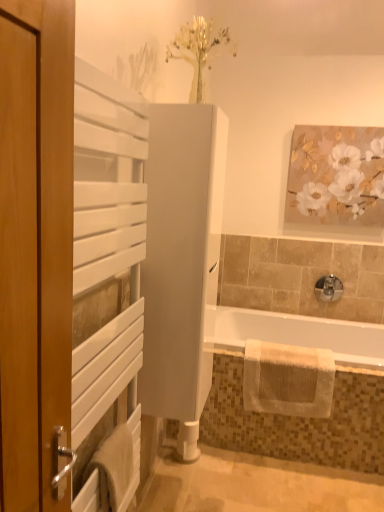
I want to click on white textured towel at lower right, which appears as the 2th bath towel when viewed from the left, so click(x=288, y=379).

The height and width of the screenshot is (512, 384). What do you see at coordinates (336, 176) in the screenshot? I see `gold textured canvas at upper right` at bounding box center [336, 176].

At what (x,y) coordinates should I click in order to perform the action: click on satin nickel faucet at lower right. Please return your answer as a coordinate pair (x, y). Looking at the image, I should click on point(328,288).

Are white textured towel at lower right, placed as the 1th bath towel when sorted from back to front, and satin nickel faucet at lower right beside each other?

white textured towel at lower right, placed as the 1th bath towel when sorted from back to front, and satin nickel faucet at lower right are clearly separated.

From the image's perspective, between white textured towel at lower right, placed as the 2th bath towel when sorted from front to back, and satin nickel faucet at lower right, who is located below?

white textured towel at lower right, placed as the 2th bath towel when sorted from front to back, appears lower in the image.

Which is in front, white textured towel at lower right, placed as the 1th bath towel when sorted from right to left, or satin nickel faucet at lower right?

white textured towel at lower right, placed as the 1th bath towel when sorted from right to left.

Are white textured towel at lower left, the 2th bath towel in the right-to-left sequence, and satin nickel faucet at lower right located far from each other?

Yes.

Is white textured towel at lower left, which ranks as the 1th bath towel in front-to-back order, to the left of satin nickel faucet at lower right from the viewer's perspective?

Yes, white textured towel at lower left, which ranks as the 1th bath towel in front-to-back order, is to the left of satin nickel faucet at lower right.

Is white textured towel at lower left, which ranks as the 1th bath towel in front-to-back order, spatially inside satin nickel faucet at lower right, or outside of it?

white textured towel at lower left, which ranks as the 1th bath towel in front-to-back order, is not enclosed by satin nickel faucet at lower right.

Is white textured towel at lower left, the 2th bath towel when ordered from back to front, turned away from satin nickel faucet at lower right?

No, satin nickel faucet at lower right is not at the back of white textured towel at lower left, the 2th bath towel when ordered from back to front.

From the image's perspective, is white glossy tub at lower right under white matte cabinet at center, acting as the 1th screen door starting from the back?

Yes, from the image's perspective, white glossy tub at lower right is beneath white matte cabinet at center, acting as the 1th screen door starting from the back.

Does white glossy tub at lower right come behind white matte cabinet at center, acting as the 1th screen door starting from the back?

That is True.

Is white glossy tub at lower right located outside white matte cabinet at center, which is the second screen door in front-to-back order?

That's correct, white glossy tub at lower right is outside of white matte cabinet at center, which is the second screen door in front-to-back order.

How different are the orientations of white glossy tub at lower right and white matte cabinet at center, acting as the 1th screen door starting from the back, in degrees?

The facing directions of white glossy tub at lower right and white matte cabinet at center, acting as the 1th screen door starting from the back, are 90 degrees apart.

Considering the sizes of white glossy bathtub at lower center and white glossy tub at lower right in the image, is white glossy bathtub at lower center wider or thinner than white glossy tub at lower right?

white glossy bathtub at lower center is wider than white glossy tub at lower right.

From the image's perspective, between white glossy bathtub at lower center and white glossy tub at lower right, who is located below?

From the image's view, white glossy tub at lower right is below.

Considering their positions, is white glossy bathtub at lower center located in front of or behind white glossy tub at lower right?

Visually, white glossy bathtub at lower center is located in front of white glossy tub at lower right.

Which object is closer to the camera taking this photo, white textured towel at lower right, which appears as the 2th bath towel when viewed from the left, or white textured towel at lower left, which ranks as the 1th bath towel in front-to-back order?

white textured towel at lower left, which ranks as the 1th bath towel in front-to-back order, is in front.

Where is `bath towel that is behind the white textured towel at lower left, the 2th bath towel in the right-to-left sequence`? bath towel that is behind the white textured towel at lower left, the 2th bath towel in the right-to-left sequence is located at coordinates (288, 379).

Who is taller, white textured towel at lower right, placed as the 2th bath towel when sorted from front to back, or white textured towel at lower left, which ranks as the 1th bath towel in left-to-right order?

white textured towel at lower right, placed as the 2th bath towel when sorted from front to back.

Based on the photo, from a real-world perspective, is white textured towel at lower right, placed as the 2th bath towel when sorted from front to back, beneath white textured towel at lower left, the 2th bath towel when ordered from back to front?

Yes, from a real-world perspective, white textured towel at lower right, placed as the 2th bath towel when sorted from front to back, is under white textured towel at lower left, the 2th bath towel when ordered from back to front.

From a real-world perspective, is white glossy tub at lower right on top of satin nickel faucet at lower right?

No, from a real-world perspective, white glossy tub at lower right is not on top of satin nickel faucet at lower right.

Based on the photo, which is more to the left, white glossy tub at lower right or satin nickel faucet at lower right?

white glossy tub at lower right is more to the left.

Considering the sizes of white glossy tub at lower right and satin nickel faucet at lower right in the image, is white glossy tub at lower right taller or shorter than satin nickel faucet at lower right?

white glossy tub at lower right is taller than satin nickel faucet at lower right.

You are a GUI agent. You are given a task and a screenshot of the screen. Output one action in this format:
    pyautogui.click(x=<x>, y=<y>)
    Task: Click on the tap that is on the right side of white glossy tub at lower right
    The height and width of the screenshot is (512, 384).
    Given the screenshot: What is the action you would take?
    pyautogui.click(x=328, y=288)

In the image, is satin nickel faucet at lower right positioned in front of or behind white textured towel at lower left, the 2th bath towel in the right-to-left sequence?

satin nickel faucet at lower right is behind white textured towel at lower left, the 2th bath towel in the right-to-left sequence.

Between satin nickel faucet at lower right and white textured towel at lower left, the 2th bath towel in the right-to-left sequence, which one has larger size?

white textured towel at lower left, the 2th bath towel in the right-to-left sequence.

Looking at this image, would you consider satin nickel faucet at lower right to be distant from white textured towel at lower left, which ranks as the 1th bath towel in front-to-back order?

Yes, satin nickel faucet at lower right and white textured towel at lower left, which ranks as the 1th bath towel in front-to-back order, are quite far apart.

Is point (336, 278) in front of point (110, 499)?

No, (336, 278) is behind (110, 499).

Where is `tap behind the white textured towel at lower right, placed as the 1th bath towel when sorted from right to left`? The width and height of the screenshot is (384, 512). tap behind the white textured towel at lower right, placed as the 1th bath towel when sorted from right to left is located at coordinates (328, 288).

This screenshot has height=512, width=384. What are the coordinates of `the 2nd bath towel in front of the satin nickel faucet at lower right, starting your count from the anchor` in the screenshot? It's located at (113, 466).

Estimate the real-world distances between objects in this image. Which object is further from gold textured canvas at upper right, satin nickel faucet at lower right or white textured towel at lower right, placed as the 1th bath towel when sorted from back to front?

white textured towel at lower right, placed as the 1th bath towel when sorted from back to front, is positioned further to the anchor gold textured canvas at upper right.

From the image, which object appears to be farther from satin nickel faucet at lower right, gold textured canvas at upper right or white textured towel at lower left, the 2th bath towel in the right-to-left sequence?

Among the two, white textured towel at lower left, the 2th bath towel in the right-to-left sequence, is located further to satin nickel faucet at lower right.

Considering their positions, is white textured towel at lower left, the 2th bath towel in the right-to-left sequence, positioned further to satin nickel faucet at lower right than white matte cabinet at center, which is the second screen door in front-to-back order?

Among the two, white textured towel at lower left, the 2th bath towel in the right-to-left sequence, is located further to satin nickel faucet at lower right.

Estimate the real-world distances between objects in this image. Which object is further from white matte radiator at left, the 2th screen door positioned from the back, white glossy bathtub at lower center or white glossy tub at lower right?

white glossy bathtub at lower center.

From the picture: When comparing their distances from satin nickel faucet at lower right, does white glossy tub at lower right or gold textured canvas at upper right seem further?

white glossy tub at lower right.

Based on their spatial positions, is white glossy bathtub at lower center or gold textured canvas at upper right closer to white textured towel at lower left, which ranks as the 1th bath towel in left-to-right order?

Based on the image, white glossy bathtub at lower center appears to be nearer to white textured towel at lower left, which ranks as the 1th bath towel in left-to-right order.

Which object lies further to the anchor point white glossy tub at lower right, gold textured canvas at upper right or white textured towel at lower right, placed as the 2th bath towel when sorted from front to back?

The object further to white glossy tub at lower right is gold textured canvas at upper right.

Which object lies further to the anchor point white matte radiator at left, which is the first screen door in front-to-back order, satin nickel faucet at lower right or white textured towel at lower left, which ranks as the 1th bath towel in left-to-right order?

satin nickel faucet at lower right lies further to white matte radiator at left, which is the first screen door in front-to-back order, than the other object.

At what (x,y) coordinates should I click in order to perform the action: click on jacuzzi located between white textured towel at lower left, the 2th bath towel in the right-to-left sequence, and white glossy bathtub at lower center in the left-right direction. Please return your answer as a coordinate pair (x, y). This screenshot has height=512, width=384. Looking at the image, I should click on (299, 417).

The width and height of the screenshot is (384, 512). I want to click on bath towel between white matte cabinet at center, which is the second screen door in front-to-back order, and satin nickel faucet at lower right from front to back, so click(288, 379).

Where is `screen door between white textured towel at lower left, which ranks as the 1th bath towel in left-to-right order, and white glossy tub at lower right, in the horizontal direction`? Image resolution: width=384 pixels, height=512 pixels. screen door between white textured towel at lower left, which ranks as the 1th bath towel in left-to-right order, and white glossy tub at lower right, in the horizontal direction is located at coordinates (181, 255).

Locate an element on the screen. The height and width of the screenshot is (512, 384). picture frame between white textured towel at lower left, the 2th bath towel in the right-to-left sequence, and satin nickel faucet at lower right in the front-back direction is located at coordinates (336, 176).